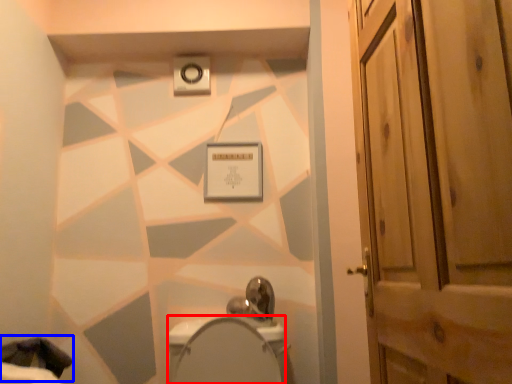
Question: Which object appears farthest to the camera in this image, bidet (highlighted by a red box) or laundry (highlighted by a blue box)?

Choices:
 (A) bidet
 (B) laundry

Answer: (B)